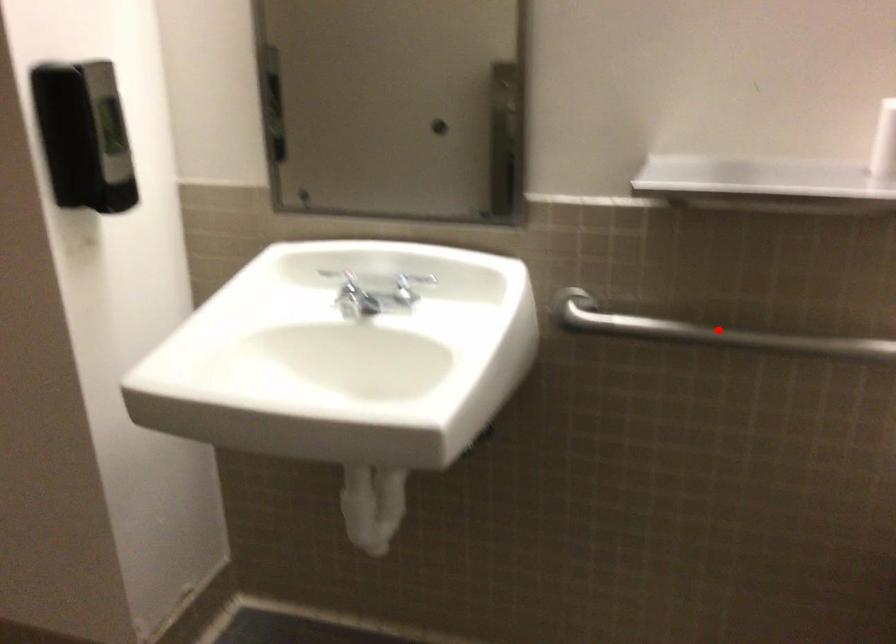
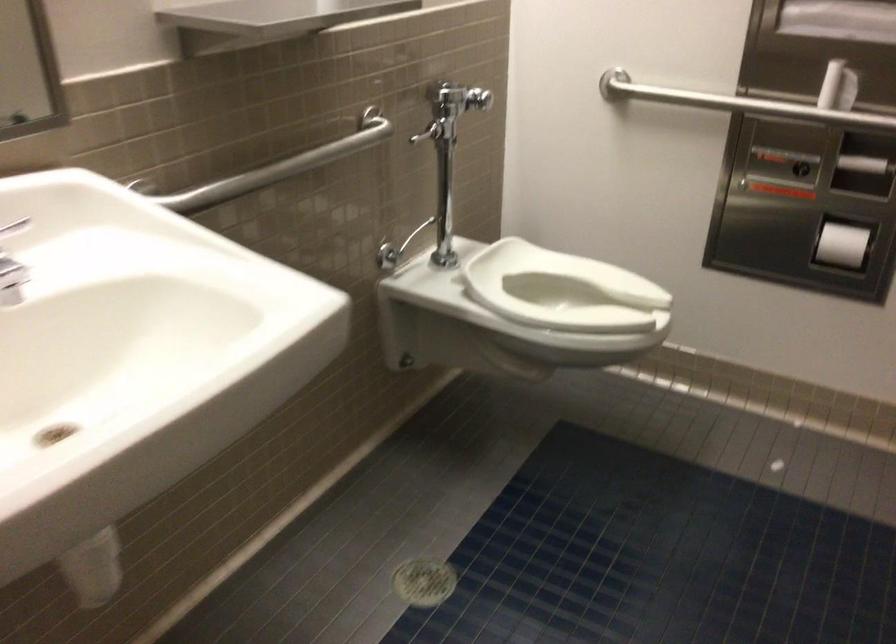
In the second image, find the point that corresponds to the highlighted location in the first image.

(277, 167)